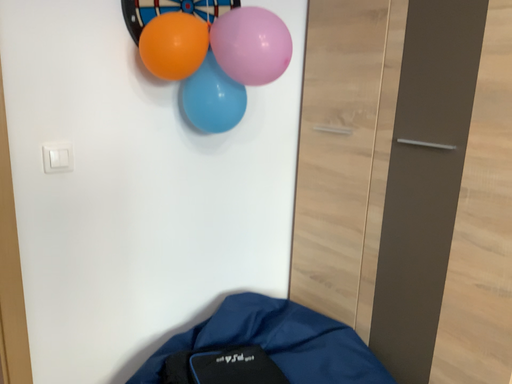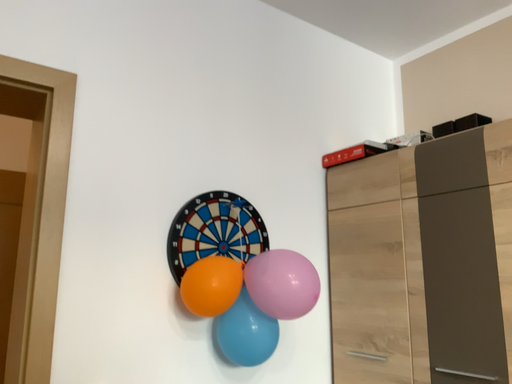
Question: Which way did the camera rotate in the video?

Choices:
 (A) rotated upward
 (B) rotated downward

Answer: (A)